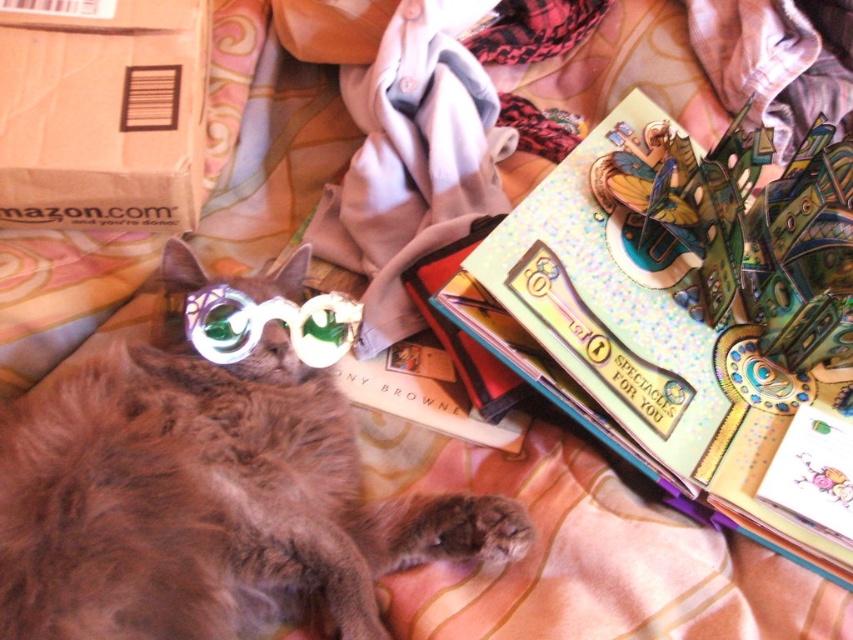
You are a visitor in this cozy indoor setting and want to place a new object between the shiny metallic book at upper right and the translucent plastic goggles at center. Which object should you place closer to the book to ensure it doesn

The shiny metallic book at upper right is much taller than the translucent plastic goggles at center, so you should place the new object closer to the book to maintain balance in height between the two existing objects.

You are holding a 36 inch long pole and want to measure the distance from the camera to the point at coordinates point (788, 413). Can your pole reach that point if you extend it fully?

The distance between the camera and point (788, 413) is 38.96 inches. Since your pole is only 36 inches long, it cannot reach the point when fully extended.

You are looking at the image and see two points marked as point 1 at coordinate (786, 253) and point 2 at coordinate (735, 13). Which point is closer to you?

Point 1 at coordinate (786, 253) is closer to you because it is in front of point 2 at coordinate (735, 13).